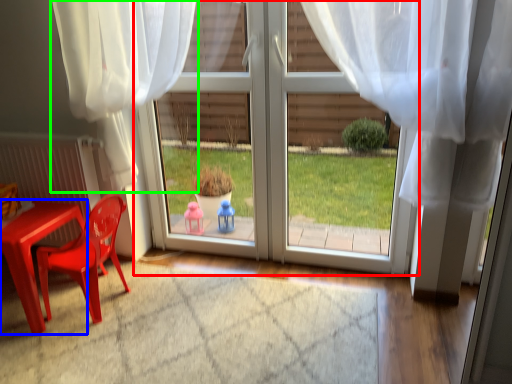
Question: Which object is the farthest from door (highlighted by a red box)? Choose among these: table (highlighted by a blue box) or curtain (highlighted by a green box).

Choices:
 (A) table
 (B) curtain

Answer: (A)